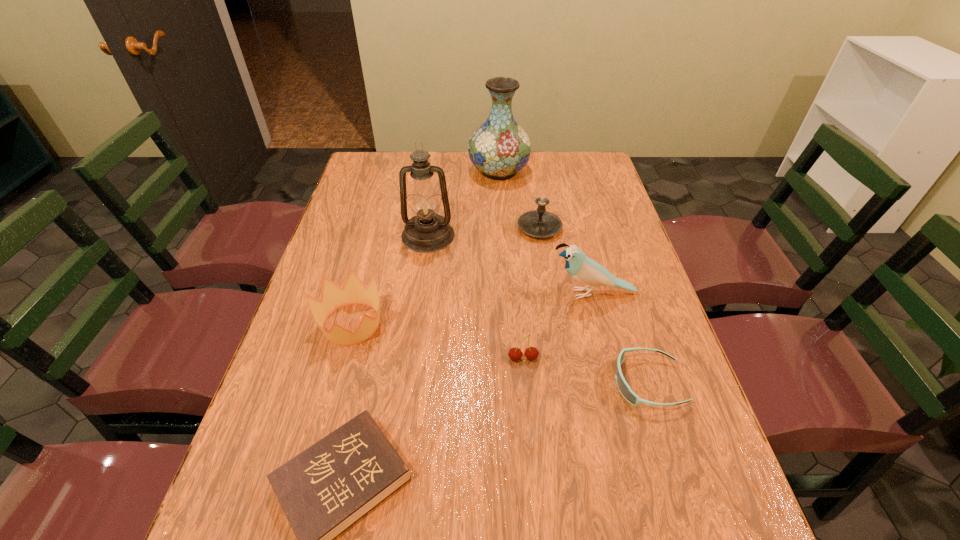
The image size is (960, 540). I want to click on bird at the right edge, so click(x=583, y=269).

Locate an element on the screen. goggles present at the right edge is located at coordinates (624, 388).

Image resolution: width=960 pixels, height=540 pixels. In order to click on free space at the far edge of the desktop in this screenshot , I will do `click(406, 165)`.

Find the location of a particular element. This screenshot has height=540, width=960. free space at the left edge of the desktop is located at coordinates (x=382, y=217).

Find the location of a particular element. The image size is (960, 540). vacant area at the right edge of the desktop is located at coordinates (681, 443).

What are the coordinates of `free space at the far left corner of the desktop` in the screenshot? It's located at (375, 172).

Locate an element on the screen. This screenshot has width=960, height=540. vacant space at the far right corner of the desktop is located at coordinates (570, 170).

Find the location of `free area in between the fifth tallest object and the oil lamp`. free area in between the fifth tallest object and the oil lamp is located at coordinates (390, 280).

Identify the location of free space between the goggles and the fifth tallest object. (500, 354).

At what (x,y) coordinates should I click in order to perform the action: click on blank region between the oil lamp and the crown. Please return your answer as a coordinate pair (x, y). Looking at the image, I should click on (390, 280).